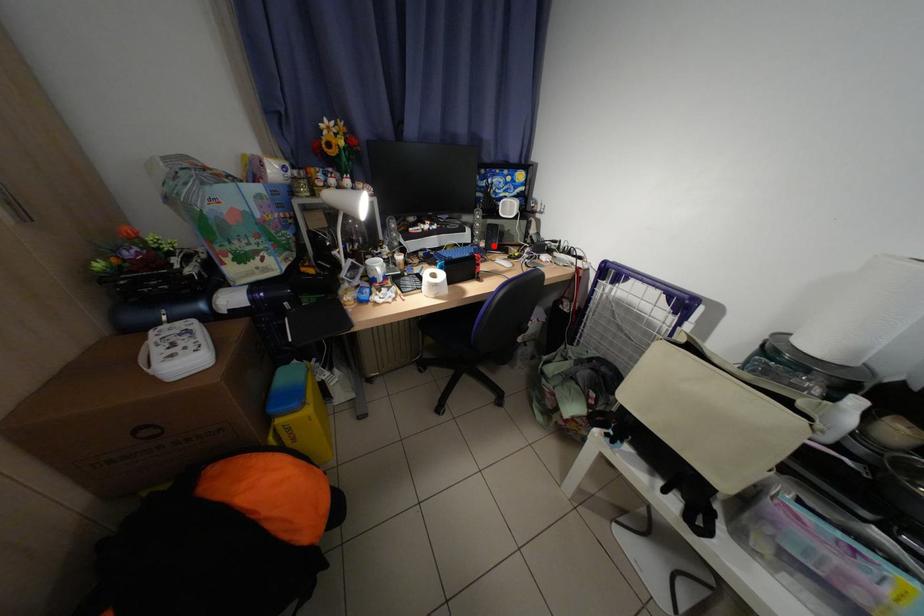
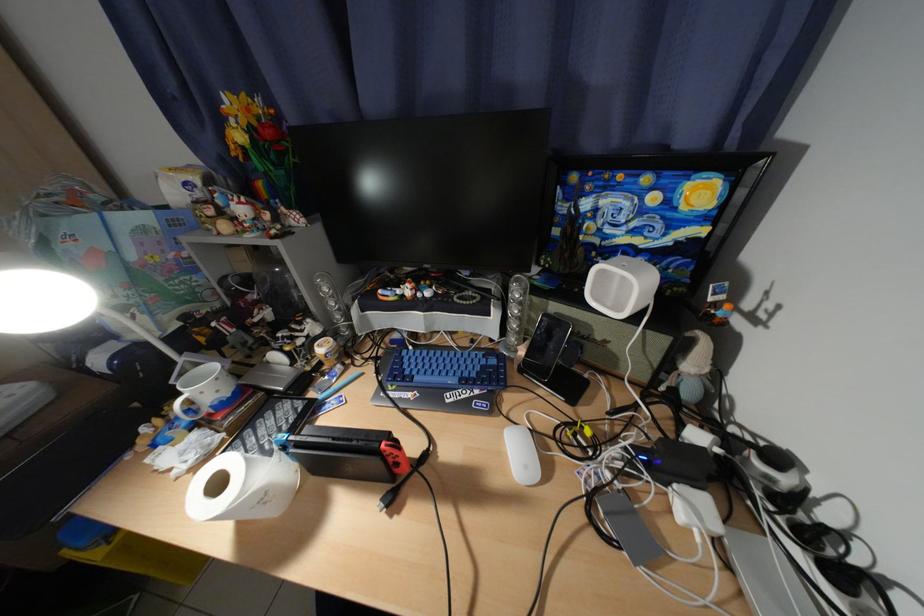
Locate, in the second image, the point that corresponds to the highlighted location in the first image.

(533, 354)